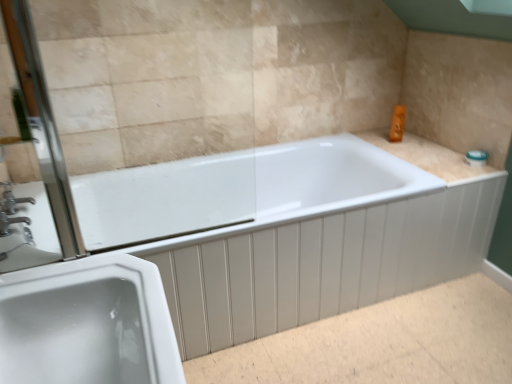
Question: From a real-world perspective, is silver metallic faucet at left positioned over white glossy bathtub at center based on gravity?

Choices:
 (A) no
 (B) yes

Answer: (B)

Question: Is silver metallic faucet at left oriented towards white glossy bathtub at center?

Choices:
 (A) no
 (B) yes

Answer: (B)

Question: From a real-world perspective, does silver metallic faucet at left sit lower than white glossy bathtub at center?

Choices:
 (A) no
 (B) yes

Answer: (A)

Question: Are silver metallic faucet at left and white glossy bathtub at center beside each other?

Choices:
 (A) yes
 (B) no

Answer: (B)

Question: Can you confirm if silver metallic faucet at left is thinner than white glossy bathtub at center?

Choices:
 (A) no
 (B) yes

Answer: (B)

Question: Choose the correct answer: Is clear glass screen door at left inside white glossy sink at lower left or outside it?

Choices:
 (A) inside
 (B) outside

Answer: (B)

Question: Does point (47, 152) appear closer or farther from the camera than point (44, 340)?

Choices:
 (A) farther
 (B) closer

Answer: (A)

Question: Is clear glass screen door at left taller or shorter than white glossy sink at lower left?

Choices:
 (A) short
 (B) tall

Answer: (B)

Question: From the image's perspective, is clear glass screen door at left above or below white glossy sink at lower left?

Choices:
 (A) below
 (B) above

Answer: (B)

Question: From the image's perspective, is beige tile counter top at upper right positioned above or below white glossy bathtub at center?

Choices:
 (A) above
 (B) below

Answer: (A)

Question: From their relative heights in the image, would you say beige tile counter top at upper right is taller or shorter than white glossy bathtub at center?

Choices:
 (A) short
 (B) tall

Answer: (A)

Question: From a real-world perspective, is beige tile counter top at upper right positioned above or below white glossy bathtub at center?

Choices:
 (A) below
 (B) above

Answer: (B)

Question: Would you say beige tile counter top at upper right is inside or outside white glossy bathtub at center?

Choices:
 (A) inside
 (B) outside

Answer: (B)

Question: From their relative heights in the image, would you say white glossy sink at lower left is taller or shorter than clear glass screen door at left?

Choices:
 (A) short
 (B) tall

Answer: (A)

Question: Considering their positions, is white glossy sink at lower left located in front of or behind clear glass screen door at left?

Choices:
 (A) behind
 (B) front

Answer: (B)